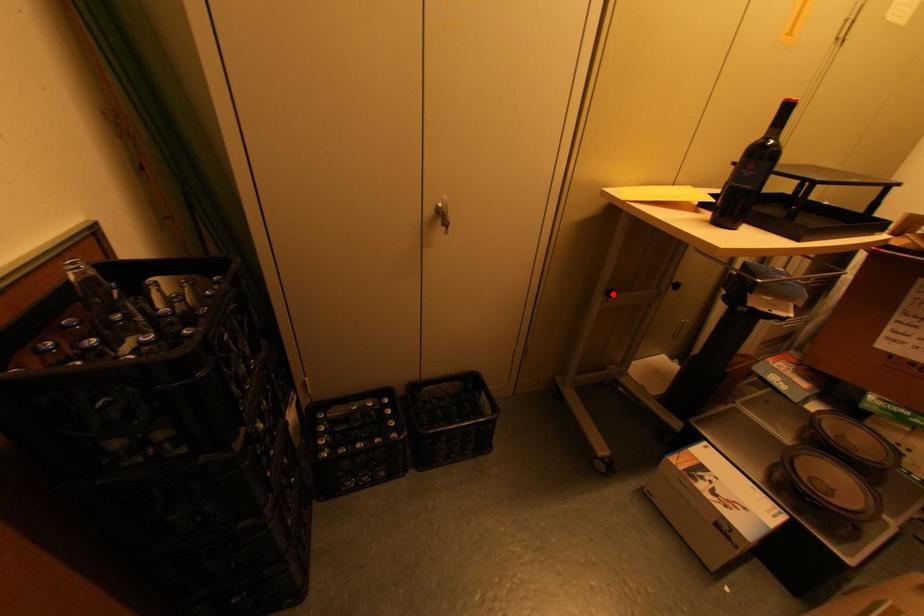
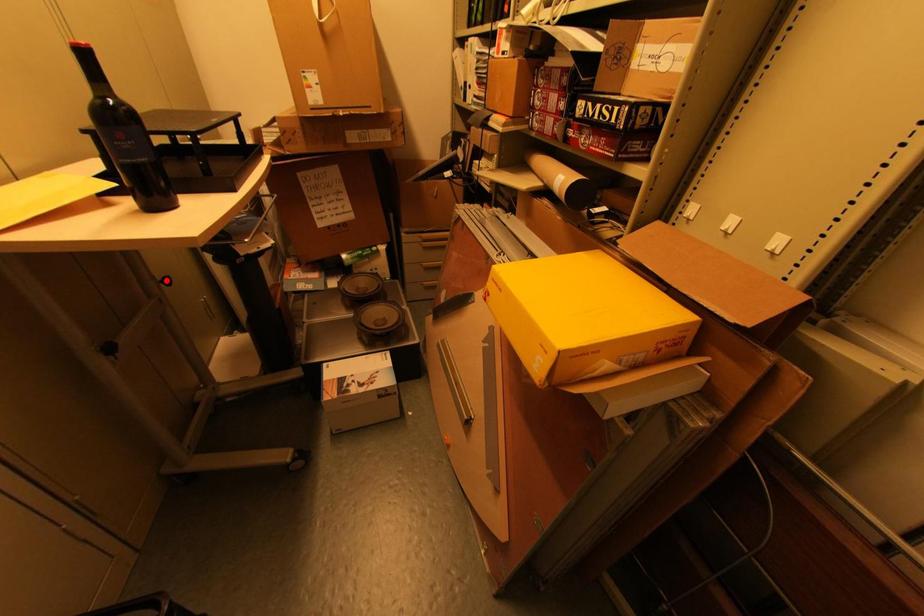
I am providing you with two images of the same scene from different viewpoints. A red point is marked on the first image and another point is marked on the second image. Are the points marked in image1 and image2 representing the same 3D position?

No